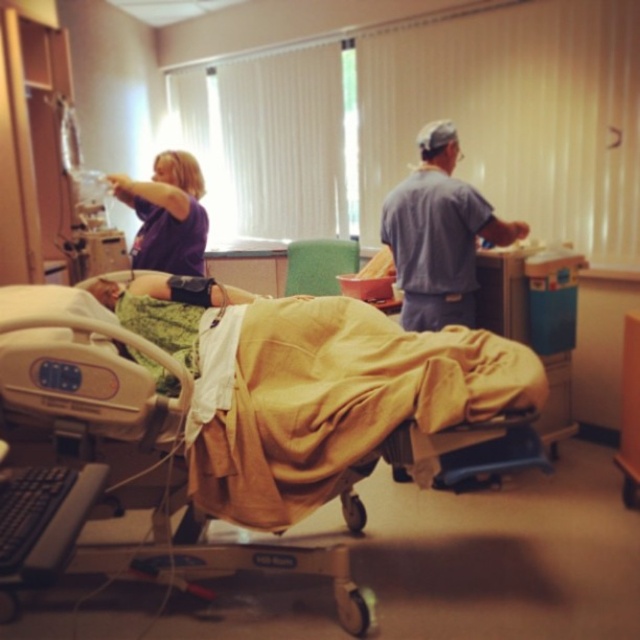
You are a nurse in the hospital. You need to move a medical cart to the yellow fabric bed at center. The cart can only move along the grid lines on the floor marked every 0.1 meters. What is the shortest distance you can move the cart to reach the bed from the starting point at the origin?

The yellow fabric bed at center is located at point (241,412). The shortest distance along the grid lines would be 0.645 meters east and 0.377 meters north, totaling approximately 1.022 meters.